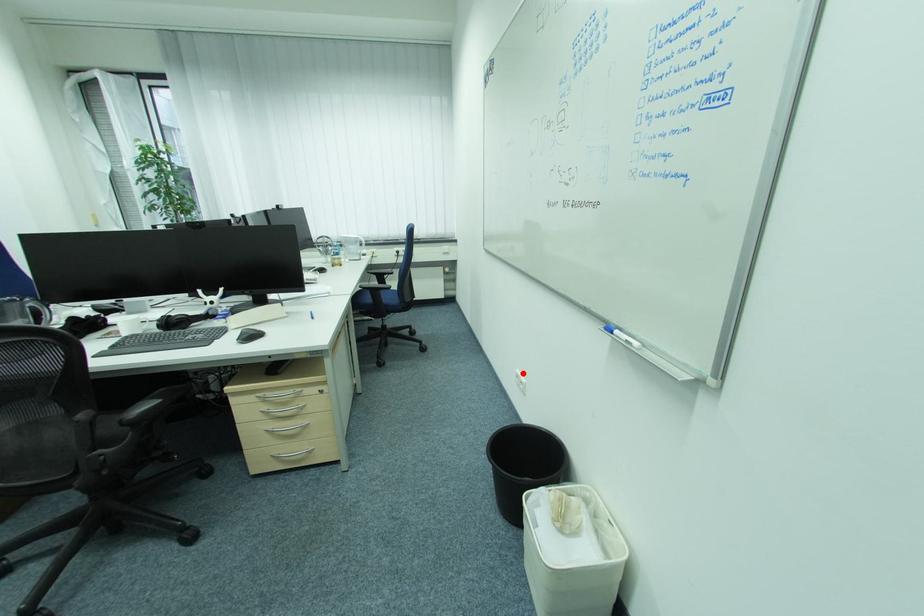
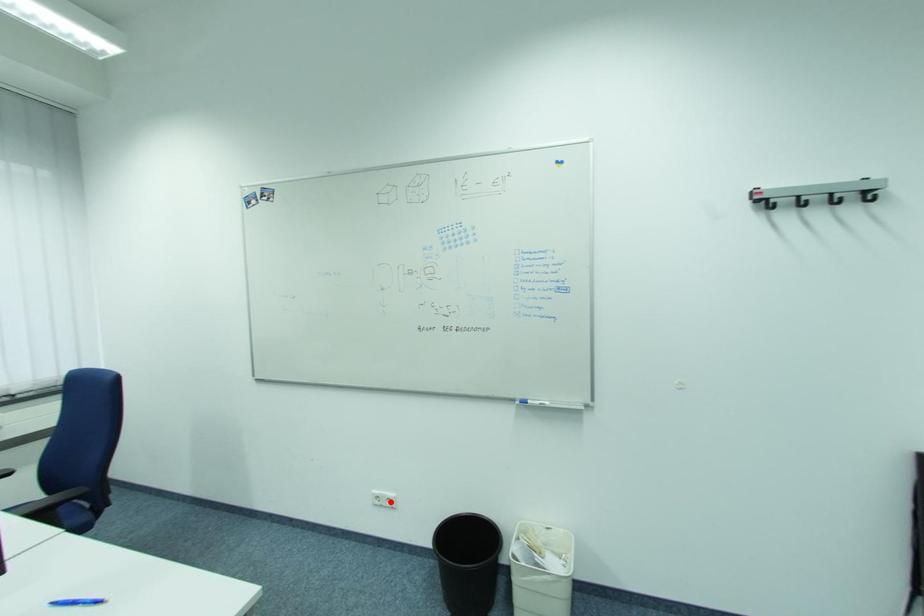
I am providing you with two images of the same scene from different viewpoints. A red point is marked on the first image and another point is marked on the second image. Do the highlighted points in image1 and image2 indicate the same real-world spot?

No